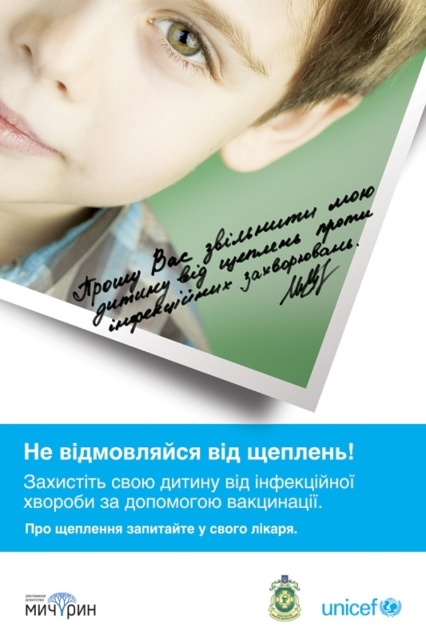
Consider the image. Who is positioned more to the right, smooth skin face at upper center or matte skin face at upper center?

Positioned to the right is smooth skin face at upper center.

Can you confirm if smooth skin face at upper center is taller than matte skin face at upper center?

Yes.

Does point (282, 60) come closer to viewer compared to point (62, 88)?

That is False.

At what (x,y) coordinates should I click in order to perform the action: click on smooth skin face at upper center. Please return your answer as a coordinate pair (x, y). Image resolution: width=426 pixels, height=640 pixels. Looking at the image, I should click on (161, 128).

Looking at this image, is matte skin face at upper center bigger than green matte eye at upper center?

Correct, matte skin face at upper center is larger in size than green matte eye at upper center.

Is matte skin face at upper center to the left of green matte eye at upper center from the viewer's perspective?

→ Correct, you'll find matte skin face at upper center to the left of green matte eye at upper center.

Who is more distant from viewer, (16, 200) or (166, 8)?

The point (16, 200) is more distant.

You are a GUI agent. You are given a task and a screenshot of the screen. Output one action in this format:
    pyautogui.click(x=<x>, y=<y>)
    Task: Click on the matte skin face at upper center
    The image size is (426, 640).
    Given the screenshot: What is the action you would take?
    pyautogui.click(x=140, y=92)

Is smooth skin face at upper center positioned at the back of green matte eye at upper center?

No, it is not.

Which is behind, point (138, 24) or point (187, 61)?

The point (187, 61) is more distant.

In order to click on smooth skin face at upper center in this screenshot , I will do `click(161, 128)`.